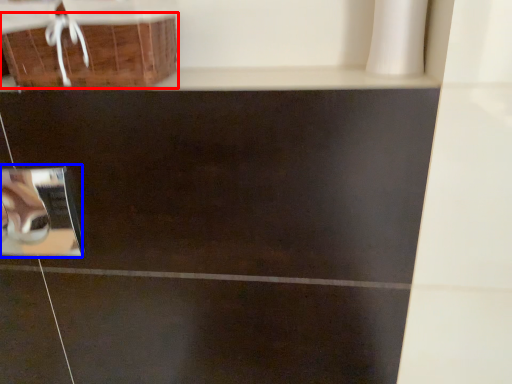
Question: Which point is closer to the camera, basket (highlighted by a red box) or square (highlighted by a blue box)?

Choices:
 (A) basket
 (B) square

Answer: (A)